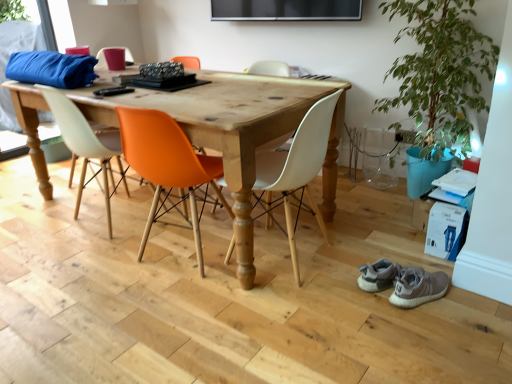
In order to face white matte chair at center, arranged as the 1th chair when viewed from the right, should I rotate leftwards or rightwards?

To face it directly, rotate right by 3.901 degrees.

What is the approximate width of orange plastic chair at center, which ranks as the 2th chair in right-to-left order?

The width of orange plastic chair at center, which ranks as the 2th chair in right-to-left order, is 20.42 inches.

What do you see at coordinates (112, 48) in the screenshot? I see `matte plastic cup at upper left, positioned as the fourth chair in right-to-left order` at bounding box center [112, 48].

What do you see at coordinates (418, 286) in the screenshot? The image size is (512, 384). I see `gray suede sneakers at lower right` at bounding box center [418, 286].

Measure the distance between wooden table at center and camera.

A distance of 5.12 feet exists between wooden table at center and camera.

At what (x,y) coordinates should I click in order to perform the action: click on white matte chair at center, arranged as the 1th chair when viewed from the right. Please return your answer as a coordinate pair (x, y). The image size is (512, 384). Looking at the image, I should click on (296, 170).

Is matte orange chair at center, which is the third chair from right to left, oriented towards green leafy plant at right?

No, matte orange chair at center, which is the third chair from right to left, is not aimed at green leafy plant at right.

Is matte orange chair at center, arranged as the second chair when viewed from the left, located outside green leafy plant at right?

Yes, matte orange chair at center, arranged as the second chair when viewed from the left, is located beyond the bounds of green leafy plant at right.

Identify the location of the 1st chair in front of the gray suede sneakers at lower right. pyautogui.click(x=168, y=167).

How different are the orientations of gray suede sneakers at lower right and orange plastic chair at center, which ranks as the 2th chair in right-to-left order, in degrees?

There is a 140-degree angle between the facing directions of gray suede sneakers at lower right and orange plastic chair at center, which ranks as the 2th chair in right-to-left order.

Does point (407, 300) lie in front of point (160, 186)?

Yes, point (407, 300) is closer to viewer.

Between gray suede sneakers at lower right and orange plastic chair at center, acting as the third chair starting from the left, which one has more height?

orange plastic chair at center, acting as the third chair starting from the left.

Which is further, (467, 121) or (129, 63)?

The point (129, 63) is more distant.

Does green leafy plant at right turn towards matte plastic cup at upper left, positioned as the fourth chair in right-to-left order?

No, green leafy plant at right does not turn towards matte plastic cup at upper left, positioned as the fourth chair in right-to-left order.

In terms of width, does white matte chair at center, acting as the 4th chair starting from the left, look wider or thinner when compared to green leafy plant at right?

Clearly, white matte chair at center, acting as the 4th chair starting from the left, has less width compared to green leafy plant at right.

From a real-world perspective, starting from the green leafy plant at right, which chair is the 2nd one below it? Please provide its 2D coordinates.

[(296, 170)]

Which is behind, white matte chair at center, acting as the 4th chair starting from the left, or green leafy plant at right?

green leafy plant at right is further away from the camera.

Which is more to the left, white matte chair at center, acting as the 4th chair starting from the left, or green leafy plant at right?

white matte chair at center, acting as the 4th chair starting from the left.

Does gray suede sneakers at lower right have a lesser height compared to matte plastic cup at upper left, the first chair from the left?

Indeed, gray suede sneakers at lower right has a lesser height compared to matte plastic cup at upper left, the first chair from the left.

Between point (425, 271) and point (131, 60), which one is positioned behind?

The point (131, 60) is more distant.

From the image's perspective, between gray suede sneakers at lower right and matte plastic cup at upper left, the first chair from the left, who is located below?

gray suede sneakers at lower right appears lower in the image.

Which object is positioned more to the right, gray suede sneakers at lower right or matte plastic cup at upper left, the first chair from the left?

gray suede sneakers at lower right.

Which of these two, wooden table at center or matte orange chair at center, which is the third chair from right to left, is bigger?

Bigger between the two is wooden table at center.

Could you tell me if wooden table at center is turned towards matte orange chair at center, arranged as the second chair when viewed from the left?

Yes, wooden table at center is facing matte orange chair at center, arranged as the second chair when viewed from the left.

Can you see wooden table at center touching matte orange chair at center, arranged as the second chair when viewed from the left?

No, wooden table at center is not in contact with matte orange chair at center, arranged as the second chair when viewed from the left.

Is the depth of orange plastic chair at center, which ranks as the 2th chair in right-to-left order, greater than that of gray suede sneakers at lower right?

No, orange plastic chair at center, which ranks as the 2th chair in right-to-left order, is in front of gray suede sneakers at lower right.

From the image's perspective, which is above, orange plastic chair at center, which ranks as the 2th chair in right-to-left order, or gray suede sneakers at lower right?

orange plastic chair at center, which ranks as the 2th chair in right-to-left order, appears higher in the image.

Who is smaller, orange plastic chair at center, which ranks as the 2th chair in right-to-left order, or gray suede sneakers at lower right?

With smaller size is gray suede sneakers at lower right.

Identify the location of the 1st chair in front of the gray suede sneakers at lower right. (168, 167).

Where is `plant on the right side of matte orange chair at center, arranged as the second chair when viewed from the left`? plant on the right side of matte orange chair at center, arranged as the second chair when viewed from the left is located at coordinates (440, 70).

There is a gray suede sneakers at lower right. Identify the location of the 1st chair above it (from a real-world perspective). Image resolution: width=512 pixels, height=384 pixels. (168, 167).

Based on their spatial positions, is gray suede sneakers at lower right or white matte chair at center, acting as the 4th chair starting from the left, closer to matte plastic cup at upper left, the first chair from the left?

The object closer to matte plastic cup at upper left, the first chair from the left, is white matte chair at center, acting as the 4th chair starting from the left.

Based on the photo, from the image, which object appears to be nearer to white matte chair at center, acting as the 4th chair starting from the left, matte plastic cup at upper left, the first chair from the left, or wooden table at center?

wooden table at center lies closer to white matte chair at center, acting as the 4th chair starting from the left, than the other object.

Looking at the image, which one is located further to green leafy plant at right, matte orange chair at center, arranged as the second chair when viewed from the left, or orange plastic chair at center, acting as the third chair starting from the left?

matte orange chair at center, arranged as the second chair when viewed from the left.

Based on their spatial positions, is matte plastic cup at upper left, the first chair from the left, or green leafy plant at right further from orange plastic chair at center, which ranks as the 2th chair in right-to-left order?

Among the two, green leafy plant at right is located further to orange plastic chair at center, which ranks as the 2th chair in right-to-left order.

Estimate the real-world distances between objects in this image. Which object is further from matte orange chair at center, arranged as the second chair when viewed from the left, matte plastic cup at upper left, the first chair from the left, or orange plastic chair at center, which ranks as the 2th chair in right-to-left order?

Among the two, matte plastic cup at upper left, the first chair from the left, is located further to matte orange chair at center, arranged as the second chair when viewed from the left.

Based on their spatial positions, is white matte chair at center, arranged as the 1th chair when viewed from the right, or green leafy plant at right further from matte orange chair at center, which is the third chair from right to left?

Based on the image, green leafy plant at right appears to be further to matte orange chair at center, which is the third chair from right to left.

When comparing their distances from wooden table at center, does matte orange chair at center, arranged as the second chair when viewed from the left, or white matte chair at center, acting as the 4th chair starting from the left, seem closer?

Based on the image, white matte chair at center, acting as the 4th chair starting from the left, appears to be nearer to wooden table at center.

Which object lies further to the anchor point green leafy plant at right, matte orange chair at center, which is the third chair from right to left, or gray suede sneakers at lower right?

matte orange chair at center, which is the third chair from right to left, is further to green leafy plant at right.

Find the location of `kitchen & dining room table between white matte chair at center, arranged as the 1th chair when viewed from the right, and matte plastic cup at upper left, the first chair from the left, in the front-back direction`. kitchen & dining room table between white matte chair at center, arranged as the 1th chair when viewed from the right, and matte plastic cup at upper left, the first chair from the left, in the front-back direction is located at coordinates (236, 132).

The image size is (512, 384). Find the location of `footwear located between wooden table at center and green leafy plant at right in the left-right direction`. footwear located between wooden table at center and green leafy plant at right in the left-right direction is located at coordinates (418, 286).

You are a GUI agent. You are given a task and a screenshot of the screen. Output one action in this format:
    pyautogui.click(x=<x>, y=<y>)
    Task: Click on the kitchen & dining room table between matte plastic cup at upper left, the first chair from the left, and gray suede sneakers at lower right
    This screenshot has width=512, height=384.
    Given the screenshot: What is the action you would take?
    pyautogui.click(x=236, y=132)

Identify the location of chair situated between wooden table at center and white matte chair at center, arranged as the 1th chair when viewed from the right, from left to right. This screenshot has height=384, width=512. (168, 167).